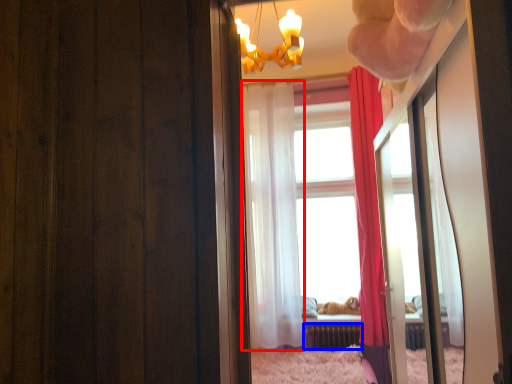
Question: Which object is further to the camera taking this photo, curtain (highlighted by a red box) or radiator (highlighted by a blue box)?

Choices:
 (A) curtain
 (B) radiator

Answer: (B)